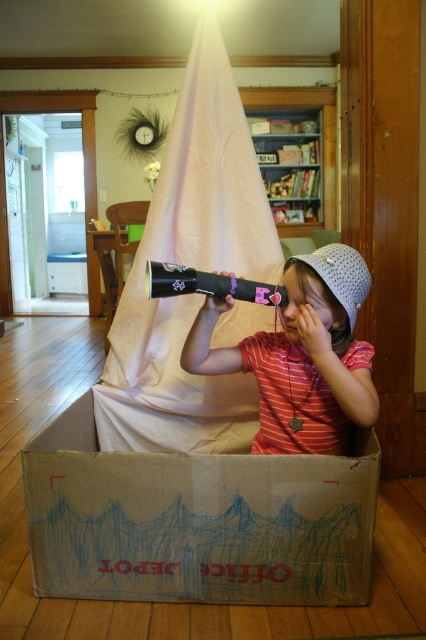
Is point (189, 476) behind point (368, 356)?

No, it is in front of (368, 356).

Which is above, brown cardboard box at lower center or matte black telescope at center?

matte black telescope at center is above.

Who is more forward, (100,584) or (281,346)?

Point (100,584)

Find the location of `brown cardboard box at lower center`. brown cardboard box at lower center is located at coordinates (195, 522).